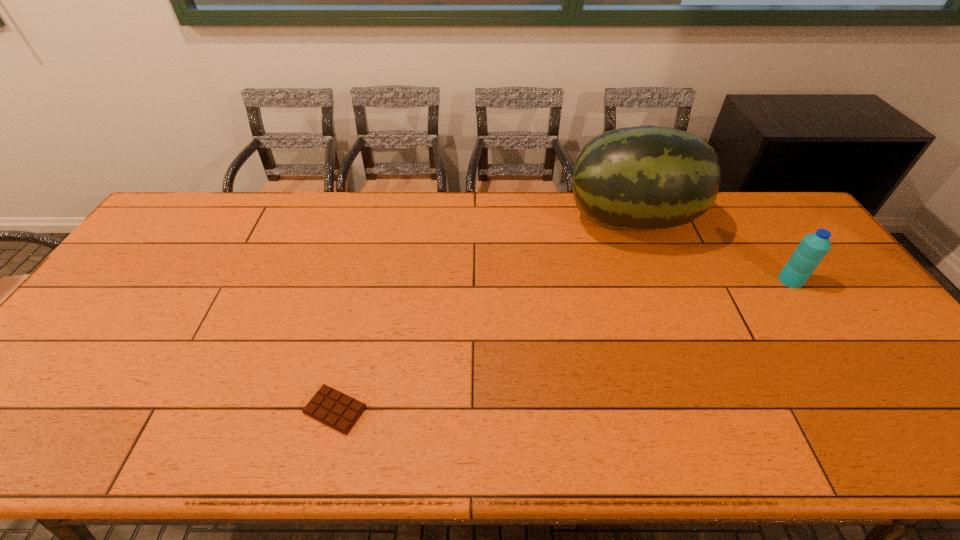
Where is `free spot between the water bottle and the nearest object`? The height and width of the screenshot is (540, 960). free spot between the water bottle and the nearest object is located at coordinates (563, 345).

You are a GUI agent. You are given a task and a screenshot of the screen. Output one action in this format:
    pyautogui.click(x=<x>, y=<y>)
    Task: Click on the vacant region between the shortest object and the farthest object
    The image size is (960, 540).
    Given the screenshot: What is the action you would take?
    pyautogui.click(x=483, y=315)

In order to click on free space between the rightmost object and the shortest object in this screenshot , I will do point(563,345).

This screenshot has width=960, height=540. Find the location of `vacant region between the nearest object and the second nearest object`. vacant region between the nearest object and the second nearest object is located at coordinates (563, 345).

The image size is (960, 540). In order to click on free spot between the shortest object and the watermelon in this screenshot , I will do `click(483, 315)`.

This screenshot has width=960, height=540. I want to click on unoccupied area between the second farthest object and the tallest object, so click(710, 250).

Where is `object that is the second closest to the rightmost object`? object that is the second closest to the rightmost object is located at coordinates click(333, 408).

Select which object appears as the closest to the leftmost object. Please provide its 2D coordinates. Your answer should be formatted as a tuple, i.e. [(x, y)], where the tuple contains the x and y coordinates of a point satisfying the conditions above.

[(648, 177)]

The image size is (960, 540). I want to click on vacant space that satisfies the following two spatial constraints: 1. on the front side of the second object from left to right; 2. on the left side of the second shortest object, so click(653, 280).

The width and height of the screenshot is (960, 540). I want to click on free location that satisfies the following two spatial constraints: 1. on the front side of the tallest object; 2. on the right side of the water bottle, so click(x=653, y=280).